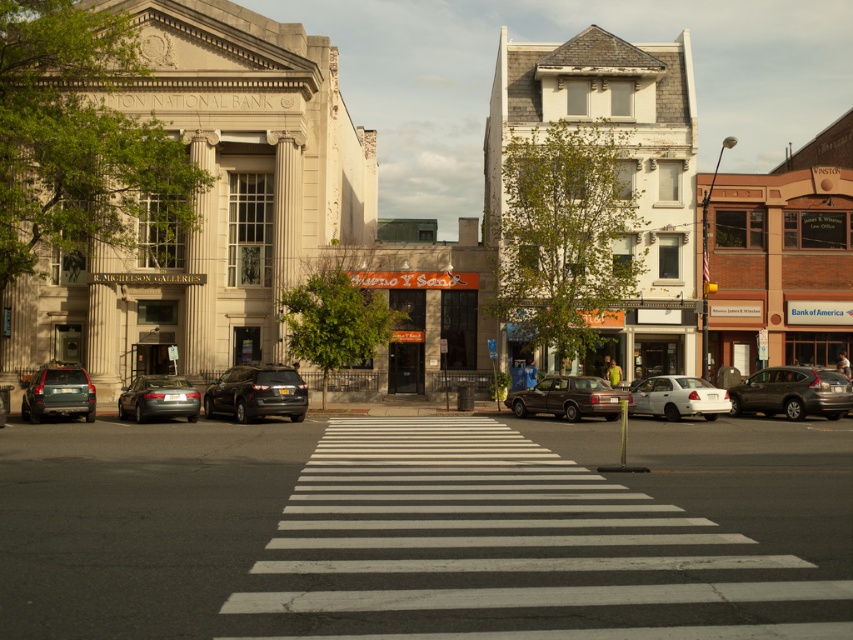
Who is shorter, white painted crosswalk at center or shiny black suv at center?

Answer: shiny black suv at center is shorter.

Does point (670, 483) come farther from viewer compared to point (231, 374)?

No.

The width and height of the screenshot is (853, 640). Identify the location of white painted crosswalk at center. point(550,538).

Which is below, shiny black suv at center or silver metallic sedan at center?

silver metallic sedan at center is below.

Find the location of `shiny black suv at center`. shiny black suv at center is located at coordinates (257, 394).

Which is in front, point (509, 394) or point (143, 404)?

Point (143, 404) is in front.

Is point (555, 401) less distant than point (180, 392)?

That is False.

This screenshot has width=853, height=640. Find the location of `brown matte sedan at center`. brown matte sedan at center is located at coordinates (569, 397).

The height and width of the screenshot is (640, 853). Find the location of `brown matte sedan at center`. brown matte sedan at center is located at coordinates 569,397.